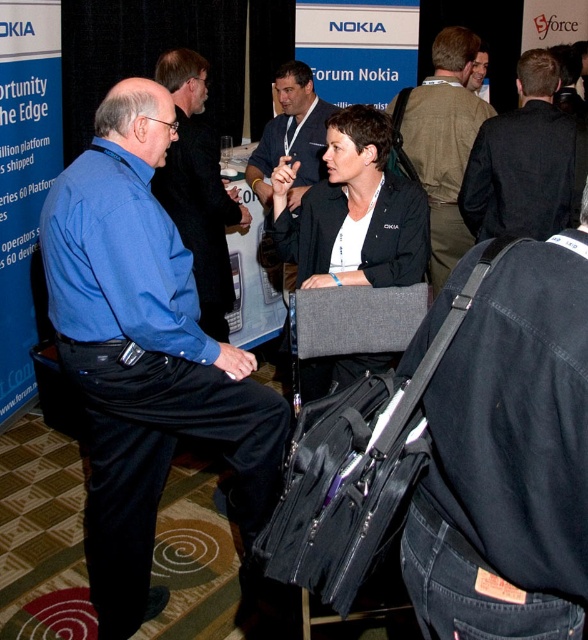
Question: Among these points, which one is farthest from the camera?

Choices:
 (A) (532, 116)
 (B) (375, 154)
 (C) (446, 148)
 (D) (212, 234)

Answer: (C)

Question: Can you confirm if blue cotton shirt at left is positioned above black denim shirt at center?

Choices:
 (A) yes
 (B) no

Answer: (A)

Question: Considering the relative positions of black leather jacket at upper right and blue shirt at left in the image provided, where is black leather jacket at upper right located with respect to blue shirt at left?

Choices:
 (A) right
 (B) left

Answer: (A)

Question: Which object appears closest to the camera in this image?

Choices:
 (A) black denim shirt at center
 (B) black leather jacket at upper right
 (C) blue cotton shirt at left

Answer: (A)

Question: Observing the image, what is the correct spatial positioning of blue shirt at left in reference to light brown leather jacket at upper right?

Choices:
 (A) left
 (B) right

Answer: (A)

Question: Which point is closer to the camera taking this photo?

Choices:
 (A) (479, 48)
 (B) (492, 189)

Answer: (B)